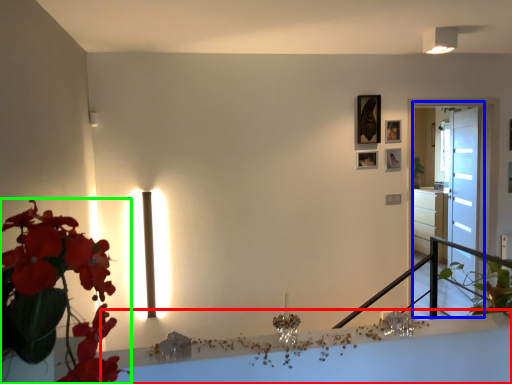
Question: Estimate the real-world distances between objects in this image. Which object is closer to table (highlighted by a red box), glass door (highlighted by a blue box) or houseplant (highlighted by a green box)?

Choices:
 (A) glass door
 (B) houseplant

Answer: (B)